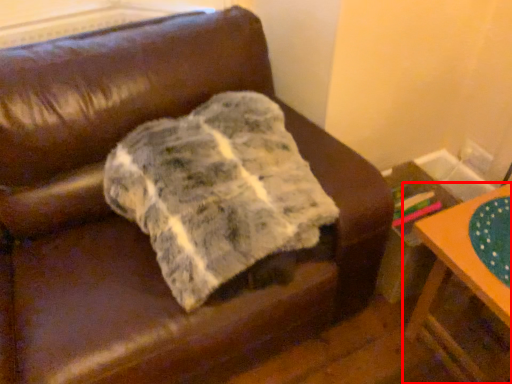
Question: From the image's perspective, what is the correct spatial relationship of table (annotated by the red box) in relation to blanket?

Choices:
 (A) below
 (B) above

Answer: (A)